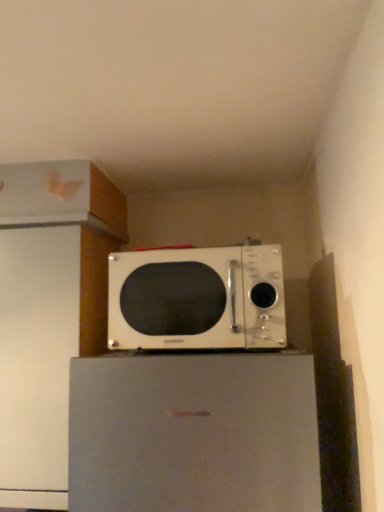
This screenshot has height=512, width=384. Describe the element at coordinates (193, 433) in the screenshot. I see `white matte refrigerator at center` at that location.

The height and width of the screenshot is (512, 384). In order to click on white matte refrigerator at center in this screenshot , I will do `click(193, 433)`.

What do you see at coordinates (197, 298) in the screenshot?
I see `white glossy microwave at center` at bounding box center [197, 298].

Locate an element on the screen. The image size is (384, 512). white glossy microwave at center is located at coordinates (197, 298).

What is the approximate height of white glossy microwave at center?

It is 10.75 inches.

Image resolution: width=384 pixels, height=512 pixels. Find the location of `white matte refrigerator at center`. white matte refrigerator at center is located at coordinates (193, 433).

Can you confirm if white glossy microwave at center is positioned to the right of white matte refrigerator at center?

A: No, white glossy microwave at center is not to the right of white matte refrigerator at center.

Does white glossy microwave at center come in front of white matte refrigerator at center?

No, white glossy microwave at center is further to the viewer.

Is point (150, 261) closer or farther from the camera than point (132, 507)?

Point (150, 261) is positioned farther from the camera compared to point (132, 507).

Looking at this image, from the image's perspective, does white glossy microwave at center appear higher than white matte refrigerator at center?

Correct, white glossy microwave at center appears higher than white matte refrigerator at center in the image.

From a real-world perspective, is white glossy microwave at center physically below white matte refrigerator at center?

Actually, white glossy microwave at center is physically above white matte refrigerator at center in the real world.

Between white glossy microwave at center and white matte refrigerator at center, which one has larger width?

white matte refrigerator at center.

Who is shorter, white glossy microwave at center or white matte refrigerator at center?

white glossy microwave at center.

Considering the relative sizes of white glossy microwave at center and white matte refrigerator at center in the image provided, is white glossy microwave at center smaller than white matte refrigerator at center?

Correct, white glossy microwave at center occupies less space than white matte refrigerator at center.

Is white glossy microwave at center located outside white matte refrigerator at center?

Absolutely, white glossy microwave at center is external to white matte refrigerator at center.

Is white glossy microwave at center placed right next to white matte refrigerator at center?

No, white glossy microwave at center is not in contact with white matte refrigerator at center.

Could you tell me if white glossy microwave at center is turned towards white matte refrigerator at center?

No, white glossy microwave at center is not aimed at white matte refrigerator at center.

Locate an element on the screen. appliance that appears below the white glossy microwave at center (from the image's perspective) is located at coordinates (193, 433).

Visually, is white matte refrigerator at center positioned to the left or to the right of white glossy microwave at center?

white matte refrigerator at center is to the right of white glossy microwave at center.

In the scene shown: Who is more distant, white matte refrigerator at center or white glossy microwave at center?

white glossy microwave at center is more distant.

In the scene shown: Which is closer to the camera, (174, 417) or (162, 320)?

Clearly, point (174, 417) is closer to the camera than point (162, 320).

From the image's perspective, does white matte refrigerator at center appear higher than white glossy microwave at center?

Answer: Incorrect, from the image's perspective, white matte refrigerator at center is lower than white glossy microwave at center.

From a real-world perspective, is white matte refrigerator at center physically below white glossy microwave at center?

Yes, from a real-world perspective, white matte refrigerator at center is below white glossy microwave at center.

Which of these two, white matte refrigerator at center or white glossy microwave at center, is wider?

With larger width is white matte refrigerator at center.

Can you confirm if white matte refrigerator at center is taller than white glossy microwave at center?

Yes.

Between white matte refrigerator at center and white glossy microwave at center, which one has smaller size?

With smaller size is white glossy microwave at center.

Is white matte refrigerator at center outside of white glossy microwave at center?

Yes, white matte refrigerator at center is not within white glossy microwave at center.

Looking at this image, are white matte refrigerator at center and white glossy microwave at center located far from each other?

Actually, white matte refrigerator at center and white glossy microwave at center are a little close together.

Could you tell me if white matte refrigerator at center is turned towards white glossy microwave at center?

No, white matte refrigerator at center is not oriented towards white glossy microwave at center.

How different are the orientations of white matte refrigerator at center and white glossy microwave at center in degrees?

The angle between the facing direction of white matte refrigerator at center and the facing direction of white glossy microwave at center is 2.64 degrees.

The width and height of the screenshot is (384, 512). In order to click on microwave oven above the white matte refrigerator at center (from the image's perspective) in this screenshot , I will do `click(197, 298)`.

Where is `microwave oven on the left of white matte refrigerator at center`? The image size is (384, 512). microwave oven on the left of white matte refrigerator at center is located at coordinates (197, 298).

Find the location of a particular element. appliance in front of the white glossy microwave at center is located at coordinates (193, 433).